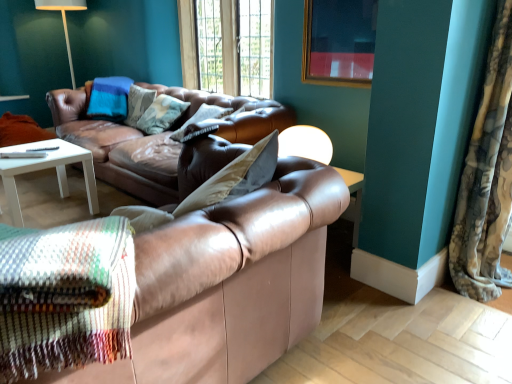
Question: Is leather couch at center, acting as the second studio couch starting from the front, smaller than fluffy fabric curtain at right?

Choices:
 (A) no
 (B) yes

Answer: (A)

Question: From the image's perspective, does leather couch at center, acting as the second studio couch starting from the front, appear higher than fluffy fabric curtain at right?

Choices:
 (A) yes
 (B) no

Answer: (A)

Question: Is leather couch at center, acting as the second studio couch starting from the front, at the left side of fluffy fabric curtain at right?

Choices:
 (A) yes
 (B) no

Answer: (A)

Question: Considering the relative sizes of leather couch at center, acting as the second studio couch starting from the front, and fluffy fabric curtain at right in the image provided, is leather couch at center, acting as the second studio couch starting from the front, shorter than fluffy fabric curtain at right?

Choices:
 (A) yes
 (B) no

Answer: (A)

Question: Is fluffy fabric curtain at right at the back of leather couch at center, acting as the second studio couch starting from the front?

Choices:
 (A) no
 (B) yes

Answer: (A)

Question: Is matte white table lamp at center in front of or behind gold-framed picture at upper center in the image?

Choices:
 (A) behind
 (B) front

Answer: (B)

Question: From a real-world perspective, is matte white table lamp at center above or below gold-framed picture at upper center?

Choices:
 (A) above
 (B) below

Answer: (B)

Question: In terms of width, does matte white table lamp at center look wider or thinner when compared to gold-framed picture at upper center?

Choices:
 (A) wide
 (B) thin

Answer: (A)

Question: Is matte white table lamp at center to the left or to the right of gold-framed picture at upper center in the image?

Choices:
 (A) left
 (B) right

Answer: (A)

Question: In the image, is gold-framed picture at upper center positioned in front of or behind leather couch at center, which ranks as the 2th studio couch in back-to-front order?

Choices:
 (A) front
 (B) behind

Answer: (B)

Question: Is gold-framed picture at upper center spatially inside leather couch at center, which ranks as the 2th studio couch in back-to-front order, or outside of it?

Choices:
 (A) inside
 (B) outside

Answer: (B)

Question: From the image's perspective, is gold-framed picture at upper center located above or below leather couch at center, which ranks as the 2th studio couch in back-to-front order?

Choices:
 (A) above
 (B) below

Answer: (A)

Question: Based on their sizes in the image, would you say gold-framed picture at upper center is bigger or smaller than leather couch at center, which ranks as the 2th studio couch in back-to-front order?

Choices:
 (A) big
 (B) small

Answer: (B)

Question: Considering the positions of fluffy fabric curtain at right and matte white table lamp at center in the image, is fluffy fabric curtain at right wider or thinner than matte white table lamp at center?

Choices:
 (A) thin
 (B) wide

Answer: (B)

Question: Considering the positions of fluffy fabric curtain at right and matte white table lamp at center in the image, is fluffy fabric curtain at right taller or shorter than matte white table lamp at center?

Choices:
 (A) short
 (B) tall

Answer: (B)